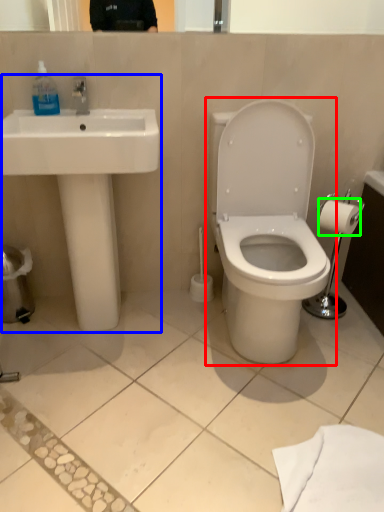
Question: Which is nearer to the toilet (highlighted by a red box)? sink (highlighted by a blue box) or toilet paper (highlighted by a green box).

Choices:
 (A) sink
 (B) toilet paper

Answer: (B)